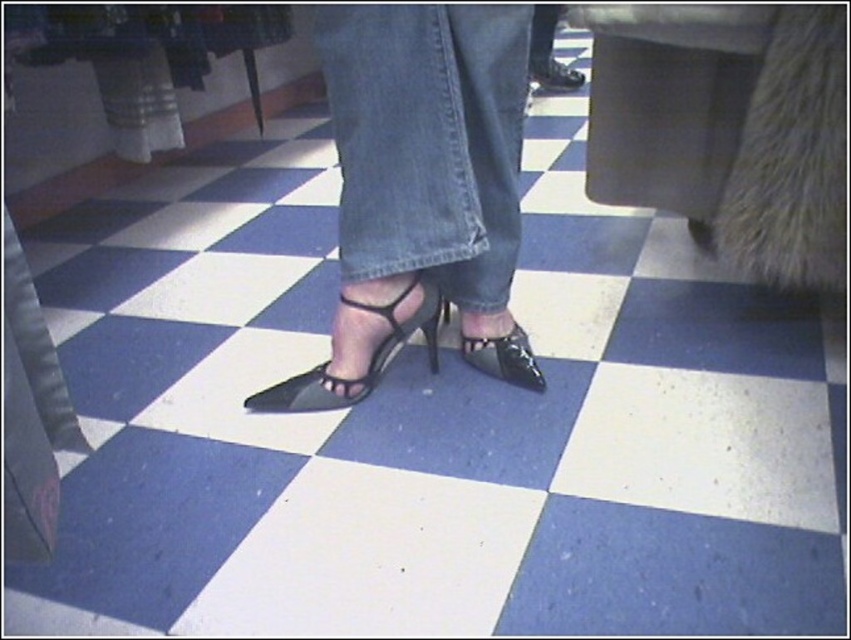
Question: Which of these objects is positioned closest to the shiny black shoe at center?

Choices:
 (A) matte black shoe at center
 (B) black leather sandal at center
 (C) denim at center

Answer: (B)

Question: Is black leather sandal at center positioned in front of shiny black shoe at center?

Choices:
 (A) yes
 (B) no

Answer: (A)

Question: Which is nearer to the shiny black shoe at center?

Choices:
 (A) black leather sandal at center
 (B) matte black shoe at center

Answer: (A)

Question: Can you confirm if shiny black shoe at center is positioned to the left of matte black shoe at center?

Choices:
 (A) yes
 (B) no

Answer: (A)

Question: Is black leather sandal at center to the right of shiny black shoe at center from the viewer's perspective?

Choices:
 (A) no
 (B) yes

Answer: (A)

Question: Which object is farther from the camera taking this photo?

Choices:
 (A) matte black shoe at center
 (B) denim at center
 (C) black leather sandal at center
 (D) shiny black shoe at center

Answer: (A)